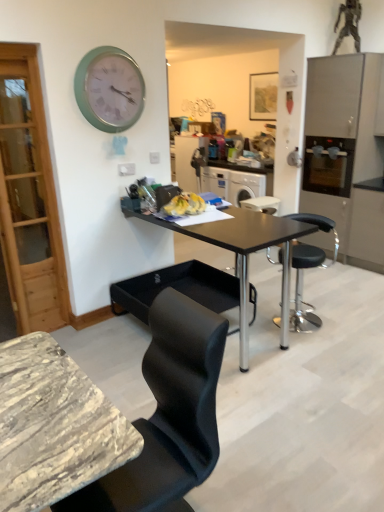
Where is `wooden picture frame at upper center`? The height and width of the screenshot is (512, 384). wooden picture frame at upper center is located at coordinates (263, 96).

Measure the distance between wooden picture frame at upper center and camera.

The distance of wooden picture frame at upper center from camera is 20.72 feet.

Locate an element on the screen. The height and width of the screenshot is (512, 384). black matte table at center is located at coordinates (246, 255).

You are a GUI agent. You are given a task and a screenshot of the screen. Output one action in this format:
    pyautogui.click(x=<x>, y=<y>)
    Task: Click on the teal metallic clock at upper left
    The width and height of the screenshot is (384, 512).
    Given the screenshot: What is the action you would take?
    pyautogui.click(x=109, y=89)

Describe the element at coordinates (328, 166) in the screenshot. I see `satin silver oven at right` at that location.

Locate an element on the screen. This screenshot has width=384, height=512. black leather bar stool at center is located at coordinates (299, 286).

What is the approximate width of satin silver cabinet at right?

It is 25.47 inches.

Identify the location of wooden picture frame at upper center. (263, 96).

How many degrees apart are the facing directions of satin silver oven at right and black leather bar stool at center?

34.7 degrees separate the facing orientations of satin silver oven at right and black leather bar stool at center.

Does satin silver oven at right have a lesser height compared to black leather bar stool at center?

Indeed, satin silver oven at right has a lesser height compared to black leather bar stool at center.

Is satin silver oven at right facing towards black leather bar stool at center?

Yes, satin silver oven at right faces towards black leather bar stool at center.

Is point (321, 234) behind point (274, 120)?

No, (321, 234) is closer to viewer.

Can you confirm if satin silver cabinet at right is taller than wooden picture frame at upper center?

Yes.

From the picture: How many degrees apart are the facing directions of satin silver cabinet at right and wooden picture frame at upper center?

satin silver cabinet at right and wooden picture frame at upper center are facing 0.307 degrees away from each other.

Considering the relative sizes of black matte table at center and satin silver oven at right in the image provided, is black matte table at center smaller than satin silver oven at right?

Incorrect, black matte table at center is not smaller in size than satin silver oven at right.

Consider the image. Considering their positions, is black matte table at center located in front of or behind satin silver oven at right?

In the image, black matte table at center appears in front of satin silver oven at right.

From the image's perspective, which is below, black matte table at center or satin silver oven at right?

From the image's view, black matte table at center is below.

Locate an element on the screen. This screenshot has height=512, width=384. table below the satin silver oven at right (from a real-world perspective) is located at coordinates (246, 255).

Considering the sizes of objects wooden picture frame at upper center and satin silver oven at right in the image provided, who is bigger, wooden picture frame at upper center or satin silver oven at right?

satin silver oven at right.

Which is behind, point (263, 91) or point (333, 176)?

The point (263, 91) is behind.

From the picture: Is wooden picture frame at upper center with satin silver oven at right?

wooden picture frame at upper center is not next to satin silver oven at right, and they're not touching.

Is the position of satin silver cabinet at right more distant than that of satin silver oven at right?

No.

Is satin silver cabinet at right at the right side of satin silver oven at right?

Incorrect, satin silver cabinet at right is not on the right side of satin silver oven at right.

From their relative heights in the image, would you say satin silver cabinet at right is taller or shorter than black leather bar stool at center?

Clearly, satin silver cabinet at right is taller compared to black leather bar stool at center.

Is point (364, 106) less distant than point (327, 225)?

No.

Would you say satin silver cabinet at right is to the left or to the right of black leather bar stool at center in the picture?

satin silver cabinet at right is positioned on black leather bar stool at center's right side.

How many degrees apart are the facing directions of satin silver cabinet at right and black leather bar stool at center?

The angle between the facing direction of satin silver cabinet at right and the facing direction of black leather bar stool at center is 32.3 degrees.

From a real-world perspective, is black leather bar stool at center positioned above or below black matte table at center?

In terms of real-world spatial position, black leather bar stool at center is below black matte table at center.

Between black leather bar stool at center and black matte table at center, which one is positioned behind?

Answer: black leather bar stool at center.

In terms of size, does black leather bar stool at center appear bigger or smaller than black matte table at center?

Considering their sizes, black leather bar stool at center takes up less space than black matte table at center.

Where is `appliance above the black leather bar stool at center (from the image's perspective)`? appliance above the black leather bar stool at center (from the image's perspective) is located at coordinates (328, 166).

Identify the location of cabinetry below the wooden picture frame at upper center (from a real-world perspective). The image size is (384, 512). (347, 152).

Based on their spatial positions, is satin silver cabinet at right or wooden picture frame at upper center further from satin silver oven at right?

Based on the image, wooden picture frame at upper center appears to be further to satin silver oven at right.

Which object lies nearer to the anchor point wooden picture frame at upper center, satin silver oven at right or black matte table at center?

satin silver oven at right.

Which object lies nearer to the anchor point black leather bar stool at center, wooden picture frame at upper center or satin silver oven at right?

Among the two, satin silver oven at right is located nearer to black leather bar stool at center.

Estimate the real-world distances between objects in this image. Which object is closer to teal metallic clock at upper left, black leather bar stool at center or satin silver cabinet at right?

black leather bar stool at center.

Estimate the real-world distances between objects in this image. Which object is closer to satin silver oven at right, wooden picture frame at upper center or black leather bar stool at center?

black leather bar stool at center lies closer to satin silver oven at right than the other object.

Which object lies nearer to the anchor point teal metallic clock at upper left, black matte table at center or satin silver oven at right?

Based on the image, black matte table at center appears to be nearer to teal metallic clock at upper left.

Considering their positions, is satin silver cabinet at right positioned further to black leather bar stool at center than wooden picture frame at upper center?

Among the two, wooden picture frame at upper center is located further to black leather bar stool at center.

From the image, which object appears to be farther from satin silver oven at right, black matte table at center or black leather bar stool at center?

black matte table at center lies further to satin silver oven at right than the other object.

This screenshot has width=384, height=512. What are the coordinates of `chair between teal metallic clock at upper left and black matte table at center in the up-down direction` in the screenshot? It's located at (299, 286).

The height and width of the screenshot is (512, 384). I want to click on appliance located between black matte table at center and wooden picture frame at upper center in the depth direction, so click(x=328, y=166).

Identify the location of clock between black matte table at center and wooden picture frame at upper center along the z-axis. The width and height of the screenshot is (384, 512). (109, 89).

This screenshot has width=384, height=512. I want to click on chair between teal metallic clock at upper left and wooden picture frame at upper center in the front-back direction, so click(x=299, y=286).